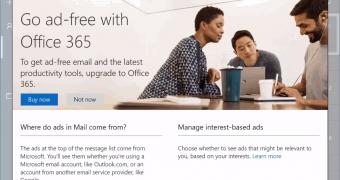
Identify the location of cup. Image resolution: width=340 pixels, height=180 pixels. (268, 86).